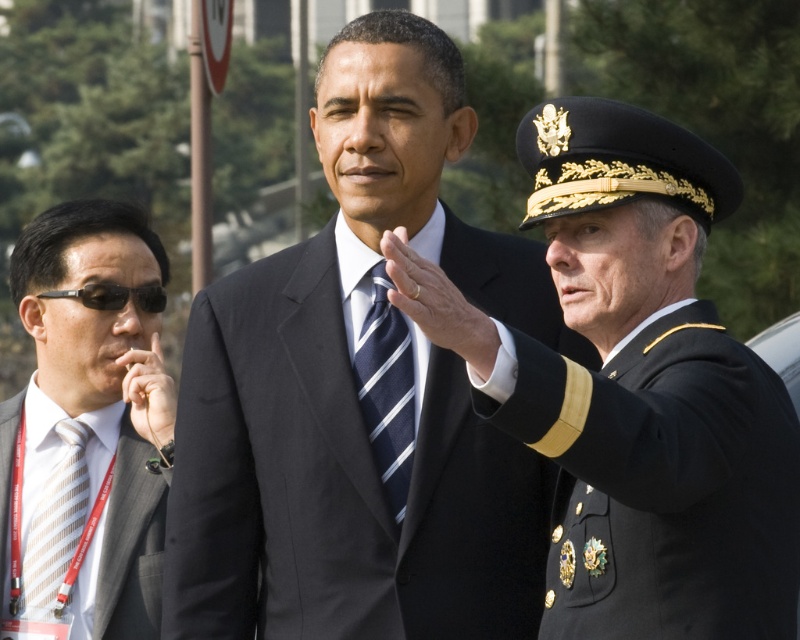
Question: Which object is positioned farthest from the black military uniform at right?

Choices:
 (A) black matte suit at center
 (B) gray striped suit at left
 (C) blue striped tie at center

Answer: (B)

Question: Among these points, which one is nearest to the camera?

Choices:
 (A) tap(592, 625)
 (B) tap(350, 81)
 (C) tap(76, 460)

Answer: (A)

Question: Is matte black suit at center positioned in front of black plastic sunglasses at left?

Choices:
 (A) no
 (B) yes

Answer: (B)

Question: Which point is closer to the camera?

Choices:
 (A) black matte suit at center
 (B) blue striped tie at center
 (C) black military uniform at right

Answer: (C)

Question: In this image, where is black matte suit at center located relative to black plastic sunglasses at left?

Choices:
 (A) above
 (B) below

Answer: (B)

Question: Is black matte suit at center bigger than black military uniform at right?

Choices:
 (A) yes
 (B) no

Answer: (A)